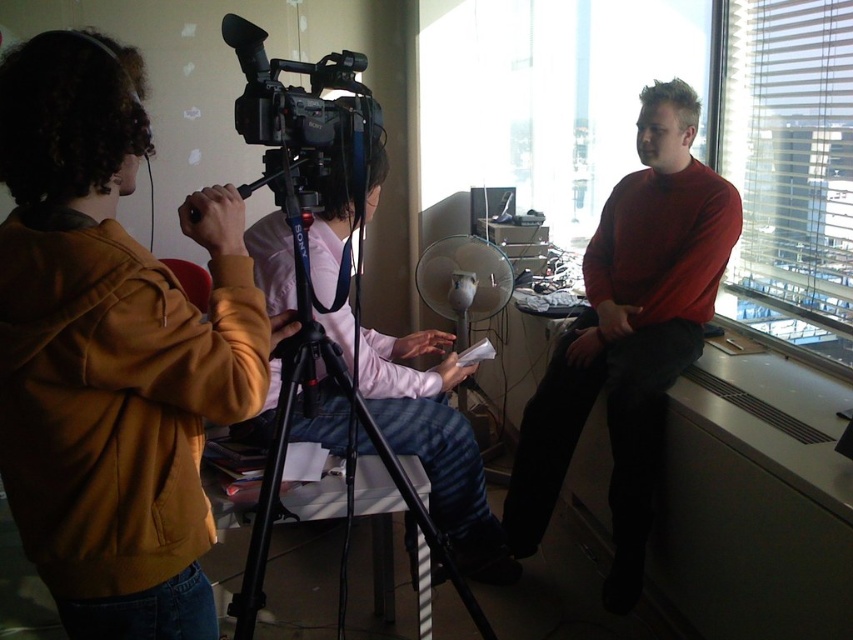
Question: Estimate the real-world distances between objects in this image. Which object is closer to the matte yellow hoodie at left?

Choices:
 (A) matte red sweater at right
 (B) transparent glass window at right

Answer: (A)

Question: Is matte yellow hoodie at left above transparent glass window at right?

Choices:
 (A) yes
 (B) no

Answer: (B)

Question: Which object is the closest to the black plastic tripod at center?

Choices:
 (A) transparent glass window at right
 (B) matte red sweater at right

Answer: (B)

Question: Is transparent glass window at right wider than black plastic tripod at center?

Choices:
 (A) yes
 (B) no

Answer: (B)

Question: Is matte red sweater at right thinner than black plastic tripod at center?

Choices:
 (A) no
 (B) yes

Answer: (B)

Question: Which point appears farthest from the camera in this image?

Choices:
 (A) (352, 349)
 (B) (805, 253)

Answer: (B)